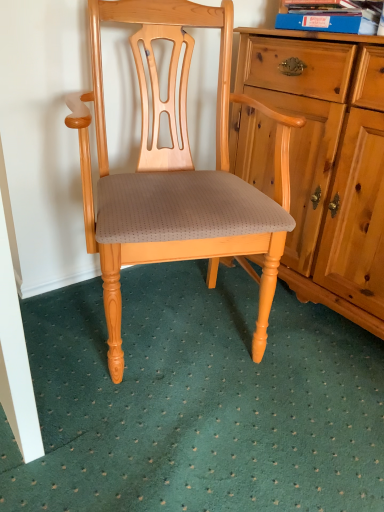
The height and width of the screenshot is (512, 384). What are the coordinates of `vacant space to the right of matte wood chair at center` in the screenshot? It's located at (317, 358).